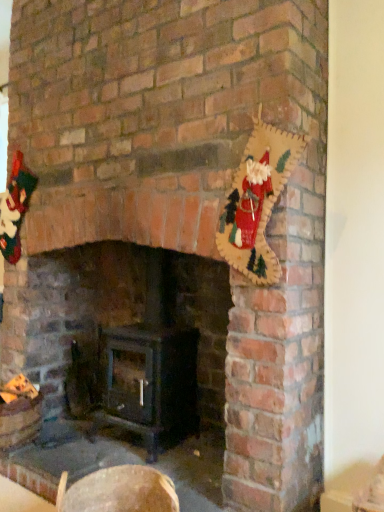
You are a GUI agent. You are given a task and a screenshot of the screen. Output one action in this format:
    pyautogui.click(x=<x>, y=<y>)
    Task: Click on the black matte wood stove at center
    This screenshot has width=384, height=512.
    Given the screenshot: What is the action you would take?
    pyautogui.click(x=128, y=324)

What is the approximate width of black matte wood stove at center?

black matte wood stove at center is 15.41 inches wide.

Image resolution: width=384 pixels, height=512 pixels. Describe the element at coordinates (128, 324) in the screenshot. I see `black matte wood stove at center` at that location.

Where is `black matte wood stove at center`? Image resolution: width=384 pixels, height=512 pixels. black matte wood stove at center is located at coordinates (128, 324).